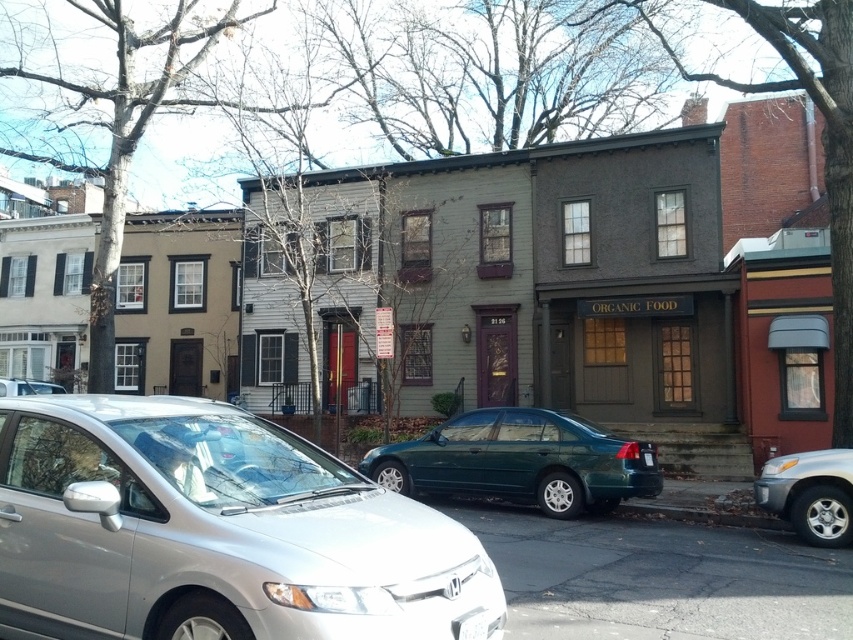
You are a pedestrian standing on the sidewalk and want to cross the street. You see the silver metallic suv at lower right and the white plastic license plate at center. Which object is closer to you?

The silver metallic suv at lower right is closer to you because it is in front of the white plastic license plate at center.

You are standing on the sidewalk and want to walk from the point at coordinates point (136,516) to the point at coordinates point (651,451). Which direction should you face to walk towards the second point?

You should face towards the southeast direction to walk from point (136,516) to point (651,451).

You are standing on the sidewalk and want to cross the street to reach the row of houses. The satin silver sedan at center is blocking your path. Can you safely walk around it without going into the street?

The satin silver sedan at center is 3.39 meters away from you, so you can safely walk around it without entering the street.